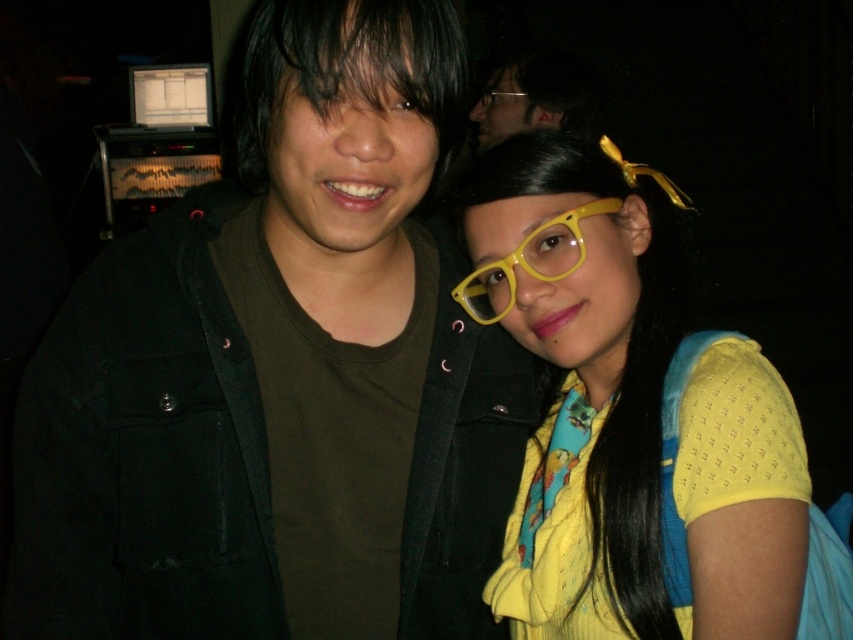
Consider the image. You are standing in the same room as the two people in the image. You want to place a small sticker exactly at the location marked by the point coordinates point (628, 416). Where should you place the sticker relative to the yellow matte glasses at center?

The point (628, 416) is on the yellow matte glasses at center, so you should place the sticker directly on the yellow matte glasses at center.

You are a photographer taking a picture of two people standing side by side. You have a camera with a 14 cm wide lens. The two people are wearing glasses. You need to ensure that both the yellow matte glasses at center and the yellow plastic glasses at center are fully in frame. Can you fit both glasses within the camera lens width?

The yellow matte glasses at center is 14.53 centimeters from yellow plastic glasses at center. Since the distance between them is greater than the 14 cm lens width, the camera lens cannot fully capture both glasses within its width.

You are a photographer standing at the center of the room. You want to take a photo of the black matte jacket at left. Where should you position yourself to capture it in the frame?

The black matte jacket at left is located at point 0.559 on the x axis and 0.328 on the y axis, so you should position yourself to the right side of the room to capture it in the frame.